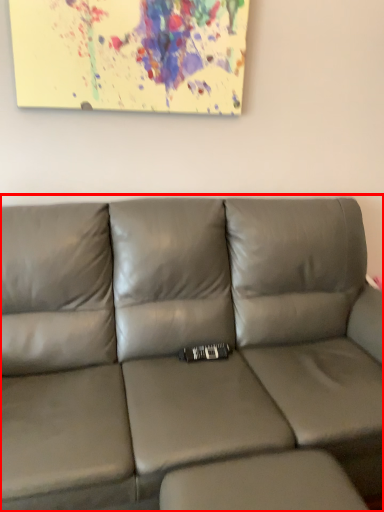
Question: In this image, where is studio couch (annotated by the red box) located relative to footrest?

Choices:
 (A) right
 (B) left

Answer: (B)